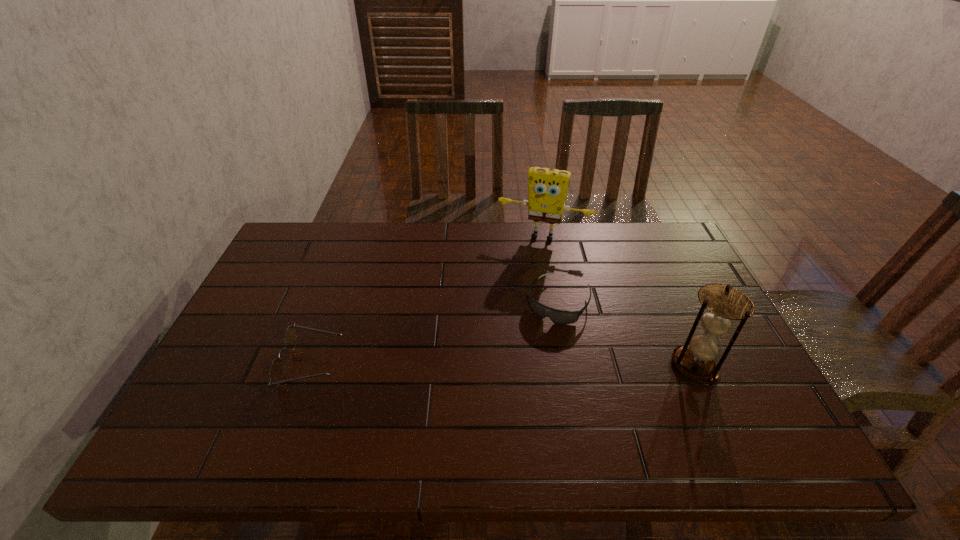
Find the location of `free space between the shortest object and the spectacles`. free space between the shortest object and the spectacles is located at coordinates (435, 333).

The width and height of the screenshot is (960, 540). In order to click on free spot between the sponge and the spectacles in this screenshot , I will do `click(427, 300)`.

I want to click on vacant area between the sponge and the goggles, so click(550, 269).

This screenshot has height=540, width=960. Identify the location of vacant area that lies between the farthest object and the spectacles. (427, 300).

Identify the location of free space between the farthest object and the spectacles. The image size is (960, 540). (427, 300).

Locate which object ranks second in proximity to the spectacles. Please provide its 2D coordinates. Your answer should be formatted as a tuple, i.e. [(x, y)], where the tuple contains the x and y coordinates of a point satisfying the conditions above.

[(547, 188)]

Identify the location of the third closest object to the spectacles. (722, 304).

At what (x,y) coordinates should I click in order to perform the action: click on free spot that satisfies the following two spatial constraints: 1. on the front side of the hourglass; 2. on the right side of the second farthest object. Please return your answer as a coordinate pair (x, y). This screenshot has width=960, height=540. Looking at the image, I should click on (570, 365).